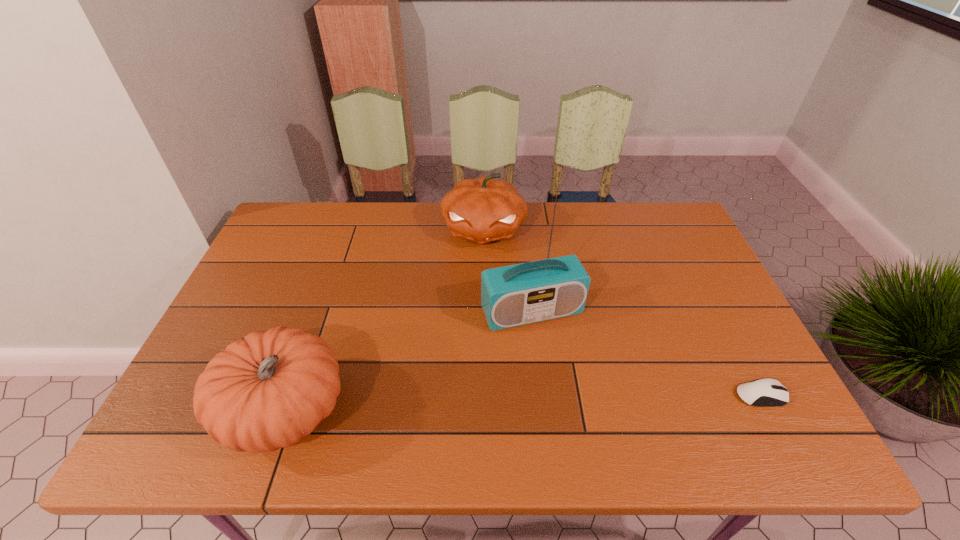
This screenshot has width=960, height=540. What are the coordinates of `free space on the desktop that is between the nearer pumpkin and the rightmost object and is positioned on the front face of the farther pumpkin` in the screenshot? It's located at (463, 406).

In order to click on vacant space on the desktop that is between the nearer pumpkin and the rightmost object and is positioned on the front panel of the radio receiver in this screenshot , I will do `click(572, 402)`.